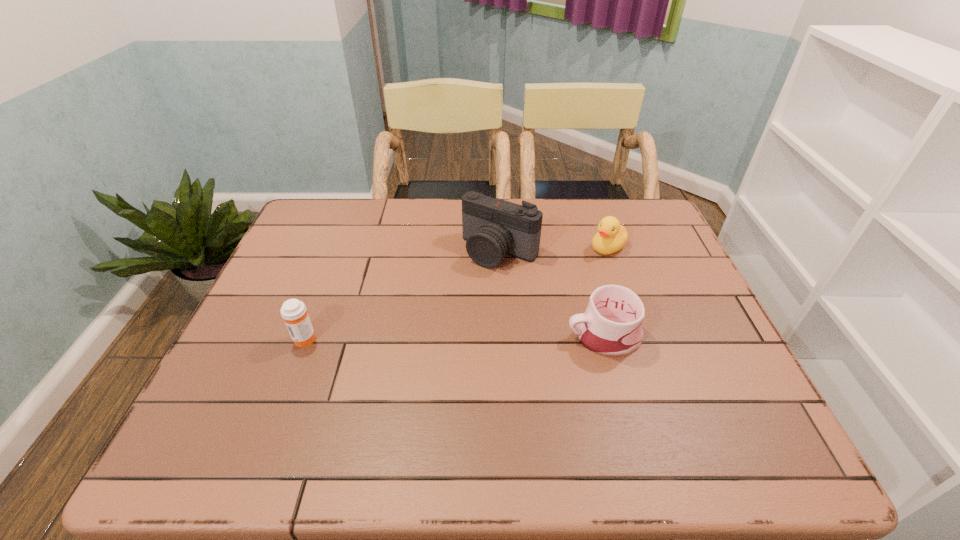
Image resolution: width=960 pixels, height=540 pixels. I want to click on free spot on the desktop that is between the leftmost object and the mug and is positioned on the face of the duckling, so click(x=446, y=337).

You are a GUI agent. You are given a task and a screenshot of the screen. Output one action in this format:
    pyautogui.click(x=<x>, y=<y>)
    Task: Click on the free space on the desktop that is between the leftmost object and the mug and is positioned at the lens of the camera
    
    Given the screenshot: What is the action you would take?
    pyautogui.click(x=428, y=337)